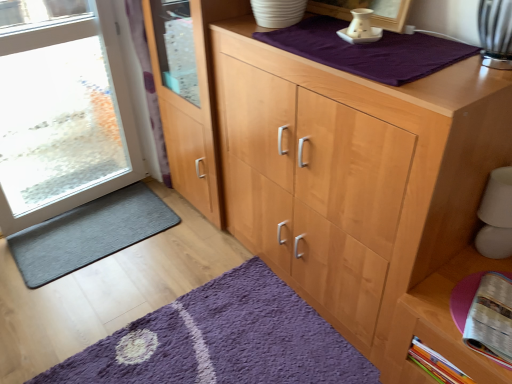
Question: Could you tell me if light wood cupboard at center is turned towards purple cotton blanket at upper center?

Choices:
 (A) no
 (B) yes

Answer: (A)

Question: Does light wood cupboard at center have a greater height compared to purple cotton blanket at upper center?

Choices:
 (A) yes
 (B) no

Answer: (A)

Question: Is light wood cupboard at center turned away from purple cotton blanket at upper center?

Choices:
 (A) no
 (B) yes

Answer: (A)

Question: Does light wood cupboard at center come in front of purple cotton blanket at upper center?

Choices:
 (A) no
 (B) yes

Answer: (B)

Question: Does light wood cupboard at center appear on the left side of purple cotton blanket at upper center?

Choices:
 (A) no
 (B) yes

Answer: (A)

Question: Is wooden cabinet at lower right bigger or smaller than clear glass door at left?

Choices:
 (A) small
 (B) big

Answer: (A)

Question: Would you say wooden cabinet at lower right is inside or outside clear glass door at left?

Choices:
 (A) inside
 (B) outside

Answer: (B)

Question: From the image's perspective, is wooden cabinet at lower right positioned above or below clear glass door at left?

Choices:
 (A) above
 (B) below

Answer: (B)

Question: Is wooden cabinet at lower right wider or thinner than clear glass door at left?

Choices:
 (A) wide
 (B) thin

Answer: (B)

Question: In terms of width, does light wood cupboard at center look wider or thinner when compared to dark gray textured mat at lower left, which is counted as the second doormat, starting from the front?

Choices:
 (A) wide
 (B) thin

Answer: (A)

Question: Looking at the image, does light wood cupboard at center seem bigger or smaller compared to dark gray textured mat at lower left, the first doormat viewed from the back?

Choices:
 (A) small
 (B) big

Answer: (B)

Question: Is light wood cupboard at center inside or outside of dark gray textured mat at lower left, the 1th doormat positioned from the top?

Choices:
 (A) outside
 (B) inside

Answer: (A)

Question: From a real-world perspective, is light wood cupboard at center positioned above or below dark gray textured mat at lower left, the first doormat viewed from the back?

Choices:
 (A) below
 (B) above

Answer: (B)

Question: Based on their sizes in the image, would you say printed paper magazine at lower right is bigger or smaller than transparent glass door at left?

Choices:
 (A) small
 (B) big

Answer: (A)

Question: Choose the correct answer: Is printed paper magazine at lower right inside transparent glass door at left or outside it?

Choices:
 (A) outside
 (B) inside

Answer: (A)